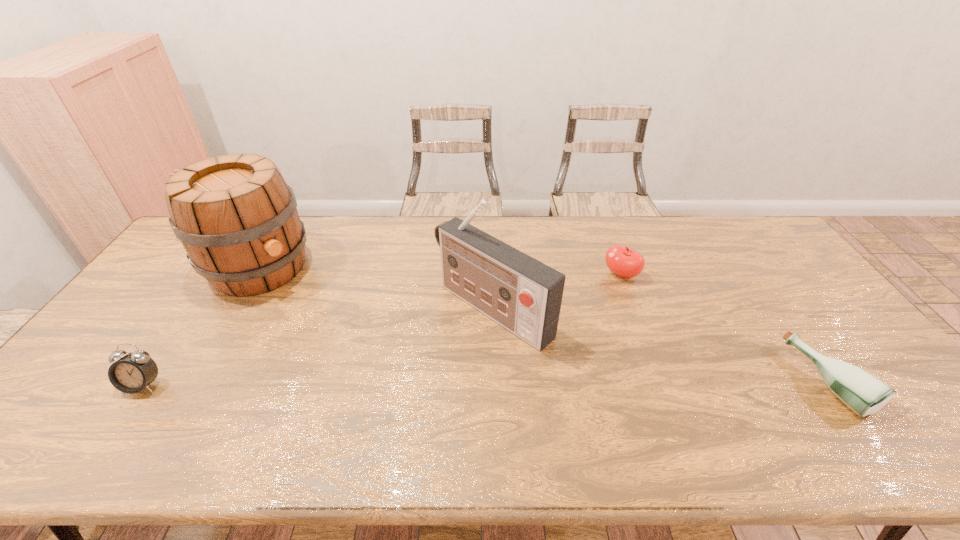
This screenshot has width=960, height=540. In order to click on vacant area that lies between the rightmost object and the apple in this screenshot , I will do `click(725, 328)`.

The image size is (960, 540). Identify the location of empty location between the bottle and the alarm clock. (486, 383).

The height and width of the screenshot is (540, 960). What are the coordinates of `empty location between the second object from right to left and the rightmost object` in the screenshot? It's located at (725, 328).

At what (x,y) coordinates should I click in order to perform the action: click on free space between the radio receiver and the shortest object. Please return your answer as a coordinate pair (x, y). This screenshot has width=960, height=540. Looking at the image, I should click on (660, 345).

Locate an element on the screen. The height and width of the screenshot is (540, 960). free area in between the apple and the cider is located at coordinates (440, 271).

Where is `free area in between the cider and the third object from right to left`? The image size is (960, 540). free area in between the cider and the third object from right to left is located at coordinates (376, 288).

The width and height of the screenshot is (960, 540). I want to click on the third closest object to the cider, so [623, 261].

Identify which object is located as the nearest to the radio receiver. Please provide its 2D coordinates. Your answer should be formatted as a tuple, i.e. [(x, y)], where the tuple contains the x and y coordinates of a point satisfying the conditions above.

[(623, 261)]